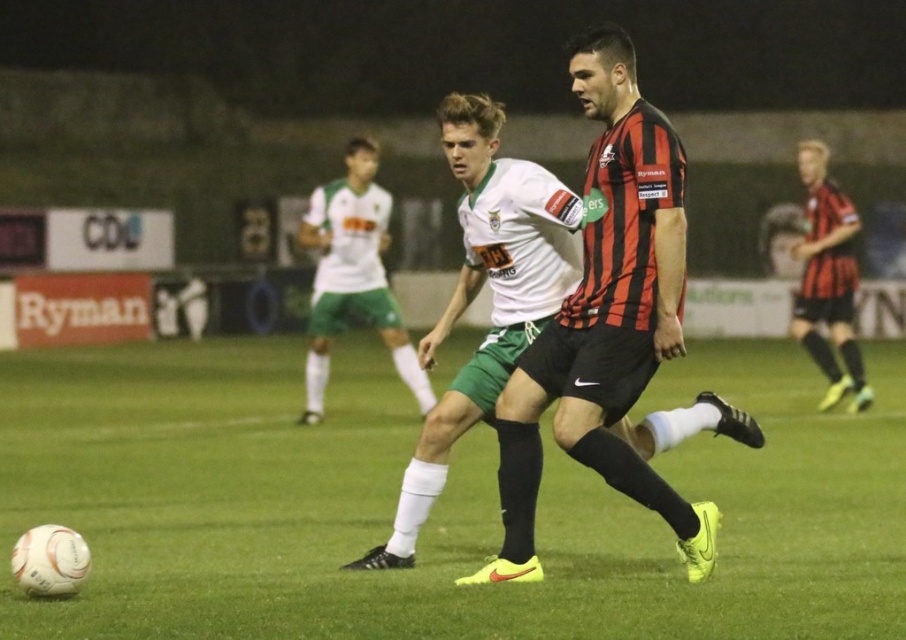
Question: Which of the following is the closest to the observer?

Choices:
 (A) (812, 173)
 (B) (323, 237)
 (C) (729, 620)

Answer: (C)

Question: Does white matte jersey at center appear on the left side of matte black shorts at right?

Choices:
 (A) no
 (B) yes

Answer: (B)

Question: Can you confirm if white matte jersey at center is positioned below matte black shorts at right?

Choices:
 (A) yes
 (B) no

Answer: (A)

Question: Estimate the real-world distances between objects in this image. Which object is farther from the matte black jersey at center?

Choices:
 (A) white matte jersey at center
 (B) matte black shorts at right

Answer: (B)

Question: Is matte black jersey at center smaller than matte black shorts at right?

Choices:
 (A) yes
 (B) no

Answer: (B)

Question: Which of the following is the closest to the observer?

Choices:
 (A) white matte jersey at center
 (B) matte black shorts at right
 (C) matte black jersey at center

Answer: (C)